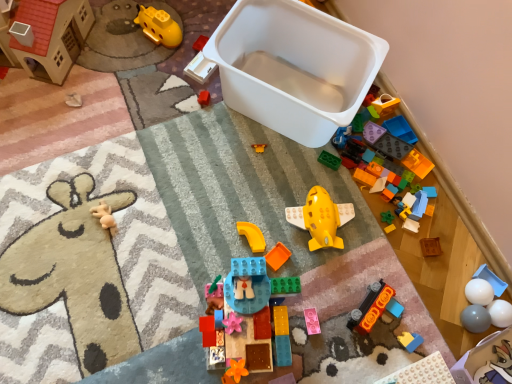
Where is `free space that is in between beige rubber bear at left, placed as the 2th toy when sorted from left to right, and orange matte block at center, acting as the 6th toy starting from the left`? Image resolution: width=512 pixels, height=384 pixels. free space that is in between beige rubber bear at left, placed as the 2th toy when sorted from left to right, and orange matte block at center, acting as the 6th toy starting from the left is located at coordinates (181, 238).